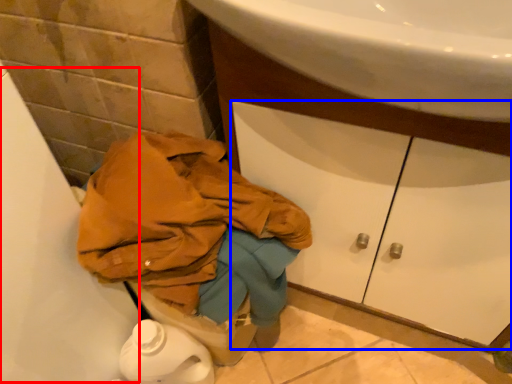
Question: Which point is further to the camera, bath (highlighted by a red box) or drawer (highlighted by a blue box)?

Choices:
 (A) bath
 (B) drawer

Answer: (B)